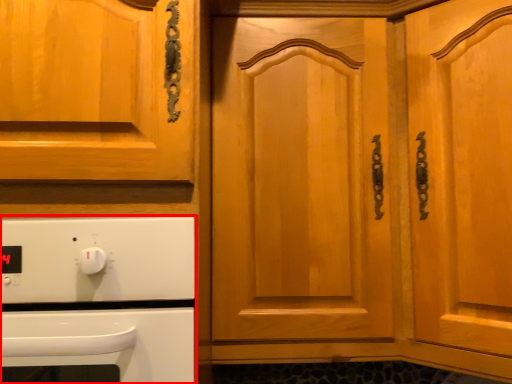
Question: In this image, where is home appliance (annotated by the red box) located relative to door?

Choices:
 (A) left
 (B) right

Answer: (A)